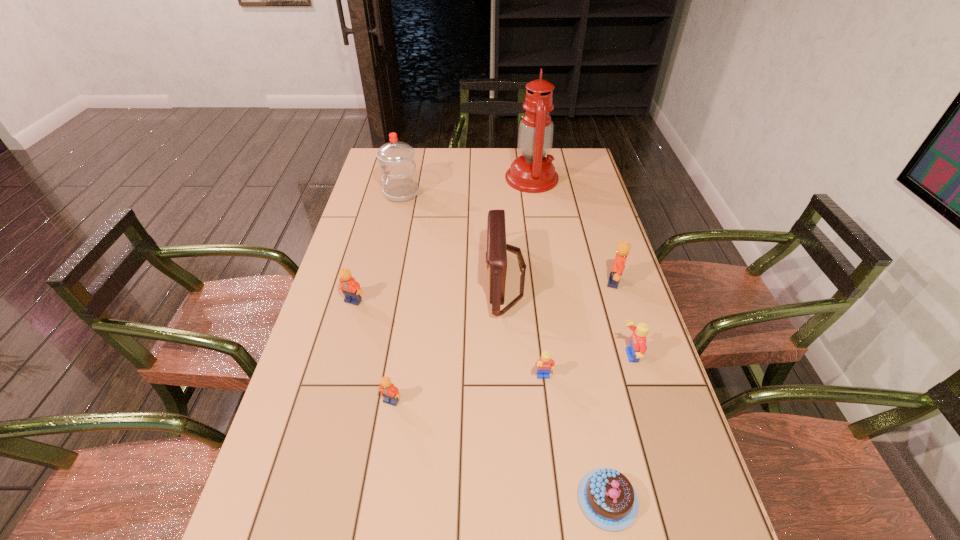
Identify the location of vacant space that satisfies the following two spatial constraints: 1. on the face of the left yellow Lego; 2. on the right side of the chocolate cake. Image resolution: width=960 pixels, height=540 pixels. (559, 500).

Locate an element on the screen. free space that satisfies the following two spatial constraints: 1. on the front-facing side of the fourth Lego from right to left; 2. on the left side of the pink chocolate cake is located at coordinates (375, 500).